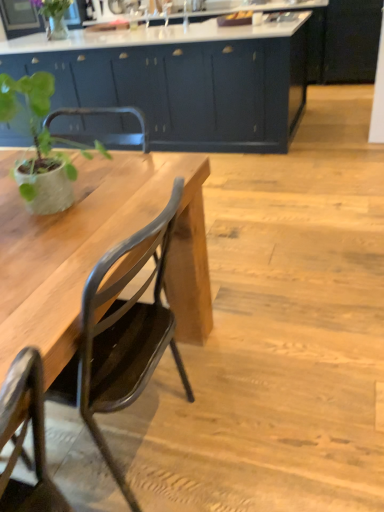
This screenshot has height=512, width=384. Find the location of `green matte vase at upper left`. green matte vase at upper left is located at coordinates (54, 16).

Image resolution: width=384 pixels, height=512 pixels. I want to click on green matte plant at left, so click(39, 145).

The width and height of the screenshot is (384, 512). Describe the element at coordinates (122, 338) in the screenshot. I see `matte black chair at left` at that location.

At what (x,y) coordinates should I click in order to perform the action: click on matte dark blue cabinets at center. Please return your answer as a coordinate pair (x, y). The width and height of the screenshot is (384, 512). Looking at the image, I should click on (183, 79).

What are the coordinates of `green matte vase at upper left` in the screenshot? It's located at (54, 16).

Could you tell me if green matte vase at upper left is facing green matte plant at left?

Yes, green matte vase at upper left is aimed at green matte plant at left.

Is point (48, 8) closer or farther from the camera than point (96, 142)?

Point (48, 8).

The height and width of the screenshot is (512, 384). I want to click on houseplant in front of the green matte vase at upper left, so click(39, 145).

Considering the relative positions of green matte vase at upper left and green matte plant at left in the image provided, is green matte vase at upper left to the left of green matte plant at left from the viewer's perspective?

Indeed, green matte vase at upper left is positioned on the left side of green matte plant at left.

The image size is (384, 512). What are the coordinates of `plant behind the matte black chair at left` in the screenshot? It's located at (54, 16).

Are green matte vase at upper left and matte black chair at left making contact?

No, green matte vase at upper left is not touching matte black chair at left.

Measure the distance from green matte vase at upper left to matte black chair at left.

green matte vase at upper left and matte black chair at left are 3.85 meters apart from each other.

From the image's perspective, which is below, green matte vase at upper left or matte dark blue cabinets at center?

matte dark blue cabinets at center, from the image's perspective.

Would you say green matte vase at upper left is to the left or to the right of matte dark blue cabinets at center in the picture?

Based on their positions, green matte vase at upper left is located to the left of matte dark blue cabinets at center.

What's the angular difference between green matte vase at upper left and matte dark blue cabinets at center's facing directions?

The angular difference between green matte vase at upper left and matte dark blue cabinets at center is 27.5 degrees.

This screenshot has height=512, width=384. Identify the location of plant above the matte dark blue cabinets at center (from a real-world perspective). (54, 16).

Where is `houseplant below the matte dark blue cabinets at center (from the image's perspective)`? Image resolution: width=384 pixels, height=512 pixels. houseplant below the matte dark blue cabinets at center (from the image's perspective) is located at coordinates (39, 145).

Does point (246, 76) come closer to viewer compared to point (58, 203)?

No, (246, 76) is behind (58, 203).

Is matte dark blue cabinets at center smaller than green matte plant at left?

Incorrect, matte dark blue cabinets at center is not smaller in size than green matte plant at left.

From the image's perspective, between matte dark blue cabinets at center and green matte plant at left, which one is located above?

From the image's view, matte dark blue cabinets at center is above.

From a real-world perspective, who is located higher, green matte plant at left or green matte vase at upper left?

From a 3D spatial view, green matte vase at upper left is above.

Is green matte plant at left positioned behind green matte vase at upper left?

No, green matte plant at left is in front of green matte vase at upper left.

Is green matte plant at left placed right next to green matte vase at upper left?

No, green matte plant at left is not in contact with green matte vase at upper left.

Does matte black chair at left have a smaller size compared to green matte vase at upper left?

No, matte black chair at left is not smaller than green matte vase at upper left.

Would you consider matte black chair at left to be distant from green matte vase at upper left?

Yes, matte black chair at left is far from green matte vase at upper left.

Looking at this image, from a real-world perspective, who is located higher, matte black chair at left or green matte vase at upper left?

green matte vase at upper left, from a real-world perspective.

Where is `chair on the right side of matte dark blue cabinets at center`? Image resolution: width=384 pixels, height=512 pixels. chair on the right side of matte dark blue cabinets at center is located at coordinates (122, 338).

Considering the sizes of objects matte dark blue cabinets at center and matte black chair at left in the image provided, who is bigger, matte dark blue cabinets at center or matte black chair at left?

matte dark blue cabinets at center.

Which of these two, matte dark blue cabinets at center or matte black chair at left, is wider?

With larger width is matte dark blue cabinets at center.

Between point (306, 18) and point (99, 332), which one is positioned behind?

The point (306, 18) is farther from the camera.

Locate an element on the screen. houseplant located below the green matte vase at upper left (from the image's perspective) is located at coordinates (39, 145).

Identify the location of plant positioned vertically above the matte black chair at left (from a real-world perspective). This screenshot has height=512, width=384. (54, 16).

Which object lies nearer to the anchor point green matte plant at left, green matte vase at upper left or matte black chair at left?

matte black chair at left is closer to green matte plant at left.

From the image, which object appears to be farther from green matte vase at upper left, matte dark blue cabinets at center or green matte plant at left?

green matte plant at left is further to green matte vase at upper left.

Considering their positions, is matte dark blue cabinets at center positioned closer to green matte vase at upper left than matte black chair at left?

matte dark blue cabinets at center is closer to green matte vase at upper left.

When comparing their distances from matte black chair at left, does matte dark blue cabinets at center or green matte vase at upper left seem closer?

Among the two, matte dark blue cabinets at center is located nearer to matte black chair at left.

Estimate the real-world distances between objects in this image. Which object is further from green matte plant at left, matte dark blue cabinets at center or green matte vase at upper left?

green matte vase at upper left is positioned further to the anchor green matte plant at left.

When comparing their distances from green matte vase at upper left, does green matte plant at left or matte dark blue cabinets at center seem further?

green matte plant at left is positioned further to the anchor green matte vase at upper left.

When comparing their distances from green matte plant at left, does matte black chair at left or matte dark blue cabinets at center seem further?

matte dark blue cabinets at center is positioned further to the anchor green matte plant at left.

Which object lies nearer to the anchor point green matte plant at left, green matte vase at upper left or matte dark blue cabinets at center?

matte dark blue cabinets at center lies closer to green matte plant at left than the other object.

You are a GUI agent. You are given a task and a screenshot of the screen. Output one action in this format:
    pyautogui.click(x=<x>, y=<y>)
    Task: Click on the houseplant located between matte black chair at left and green matte vase at upper left in the depth direction
    This screenshot has height=512, width=384.
    Given the screenshot: What is the action you would take?
    pyautogui.click(x=39, y=145)

At what (x,y) coordinates should I click in order to perform the action: click on cabinetry between green matte plant at left and green matte vase at upper left from front to back. Please return your answer as a coordinate pair (x, y). Image resolution: width=384 pixels, height=512 pixels. Looking at the image, I should click on (183, 79).

Locate an element on the screen. The image size is (384, 512). houseplant positioned between matte black chair at left and matte dark blue cabinets at center from near to far is located at coordinates (39, 145).

Identify the location of cabinetry between matte black chair at left and green matte vase at upper left in the front-back direction. The width and height of the screenshot is (384, 512). (183, 79).